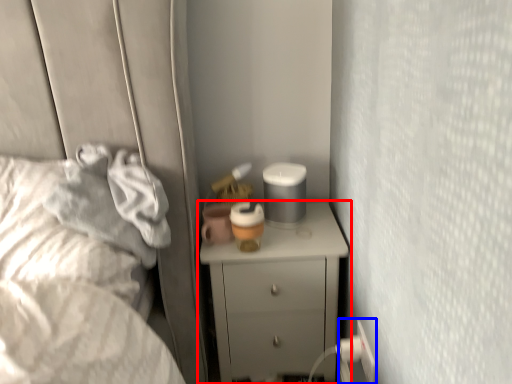
Question: Which point is closer to the camera, chest of drawers (highlighted by a red box) or electric outlet (highlighted by a blue box)?

Choices:
 (A) chest of drawers
 (B) electric outlet

Answer: (B)